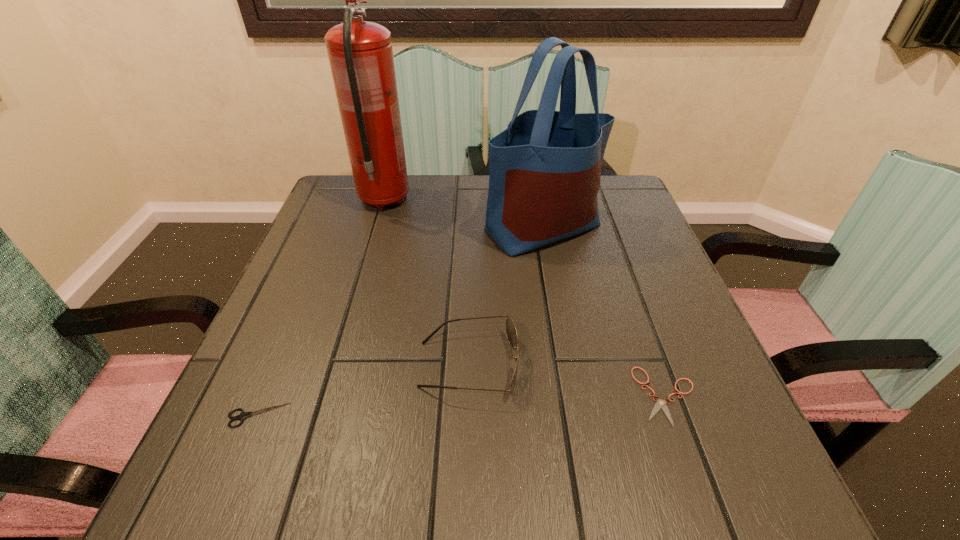
Identify the location of unoccupied position between the tallest object and the left shears. This screenshot has height=540, width=960. [x=321, y=308].

This screenshot has width=960, height=540. Find the location of `free area in between the tallest object and the handbag`. free area in between the tallest object and the handbag is located at coordinates (464, 214).

Identify the location of free spot between the third tallest object and the fire extinguisher. The image size is (960, 540). (426, 282).

Image resolution: width=960 pixels, height=540 pixels. Identify the location of free space between the right shears and the fourth tallest object. (463, 406).

Where is `free space between the third tallest object and the left shears`? The height and width of the screenshot is (540, 960). free space between the third tallest object and the left shears is located at coordinates (363, 390).

I want to click on free space between the tallest object and the shortest object, so click(x=526, y=298).

The width and height of the screenshot is (960, 540). I want to click on object identified as the third closest to the shorter shears, so click(242, 416).

This screenshot has width=960, height=540. What are the coordinates of `object that is the closest to the taller shears` in the screenshot? It's located at (511, 332).

I want to click on vacant region that satisfies the following two spatial constraints: 1. on the front-facing side of the right shears; 2. on the right side of the third shortest object, so click(x=468, y=396).